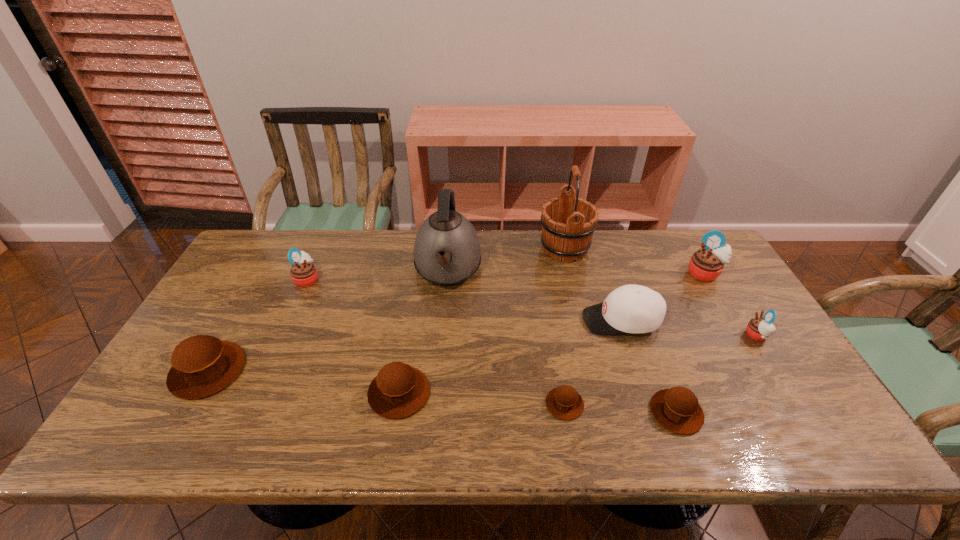
Find the location of `wine bucket that is at the far edge`. wine bucket that is at the far edge is located at coordinates (568, 223).

Locate an element on the screen. kettle that is positioned at the far edge is located at coordinates (447, 251).

You are a GUI agent. You are given a task and a screenshot of the screen. Output one action in this format:
    pyautogui.click(x=<x>, y=<y>)
    Task: Click on the object at the left edge
    
    Given the screenshot: What is the action you would take?
    pyautogui.click(x=202, y=365)

Where is `object that is positioned at the far right corner`? object that is positioned at the far right corner is located at coordinates (706, 264).

In the image, there is a desktop. Identify the location of free space at the far edge. (600, 267).

Identify the location of vacant space at the near edge. (287, 426).

Identify the location of vacant space at the left edge of the desktop. This screenshot has height=540, width=960. (182, 413).

Identify the location of vacant space at the right edge of the desktop. (708, 294).

In the image, there is a desktop. Where is `free space at the far left corner`? free space at the far left corner is located at coordinates (254, 272).

At what (x,y) coordinates should I click in order to perform the action: click on free location at the near left corner of the desktop. Please return your answer as a coordinate pair (x, y). Looking at the image, I should click on tap(182, 440).